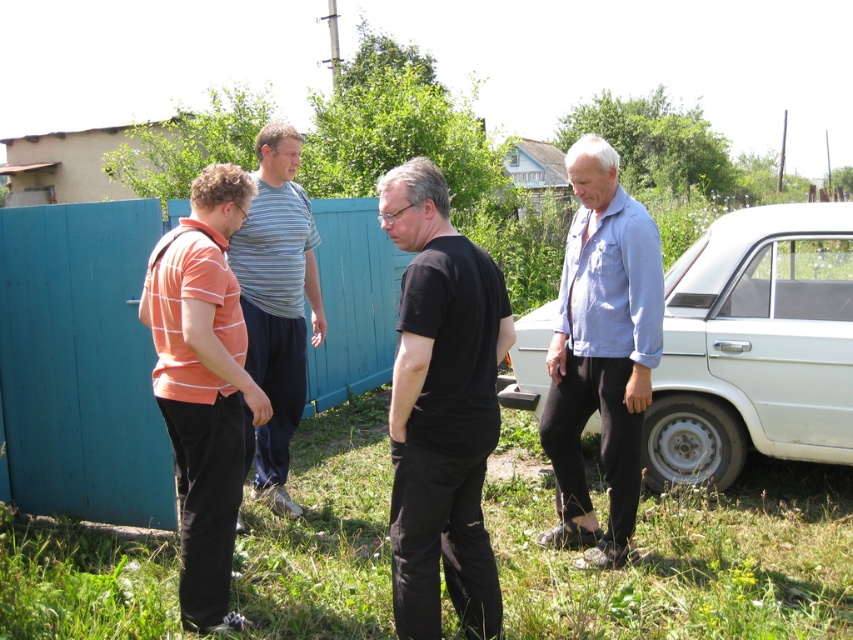
Question: Which point is closer to the camera taking this photo?

Choices:
 (A) (654, 618)
 (B) (813, 419)

Answer: (A)

Question: Which point appears farthest from the camera in this image?

Choices:
 (A) (585, 275)
 (B) (682, 336)

Answer: (B)

Question: Can you confirm if blue denim shirt at right is wider than striped cotton shirt at center?

Choices:
 (A) no
 (B) yes

Answer: (A)

Question: Is white matte car at right to the left of striped cotton shirt at center from the viewer's perspective?

Choices:
 (A) no
 (B) yes

Answer: (A)

Question: Which of the following is the farthest from the observer?

Choices:
 (A) (434, 218)
 (B) (305, 266)
 (C) (178, 509)

Answer: (B)

Question: Can you confirm if blue denim shirt at right is bigger than orange striped shirt at left?

Choices:
 (A) yes
 (B) no

Answer: (B)